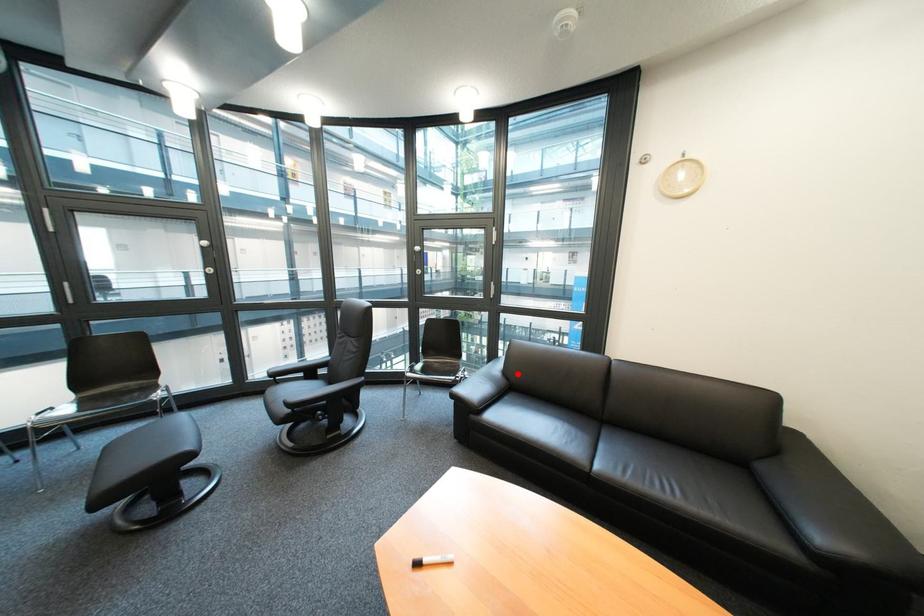
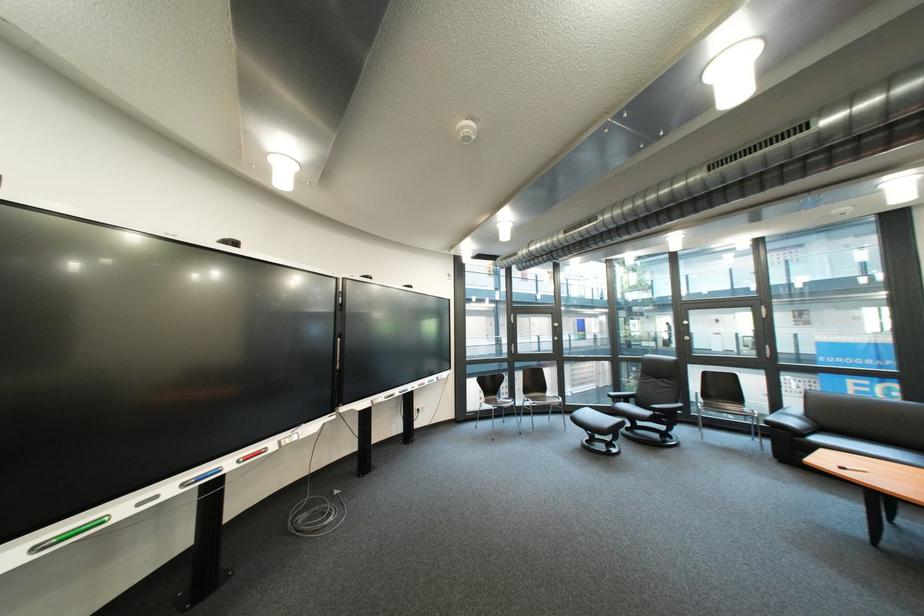
Question: I am providing you with two images of the same scene from different viewpoints. Image1 has a red point marked. In image2, the corresponding 3D location appears at what relative position? Reply with the corresponding letter.

Choices:
 (A) Closer
 (B) Farther

Answer: (A)